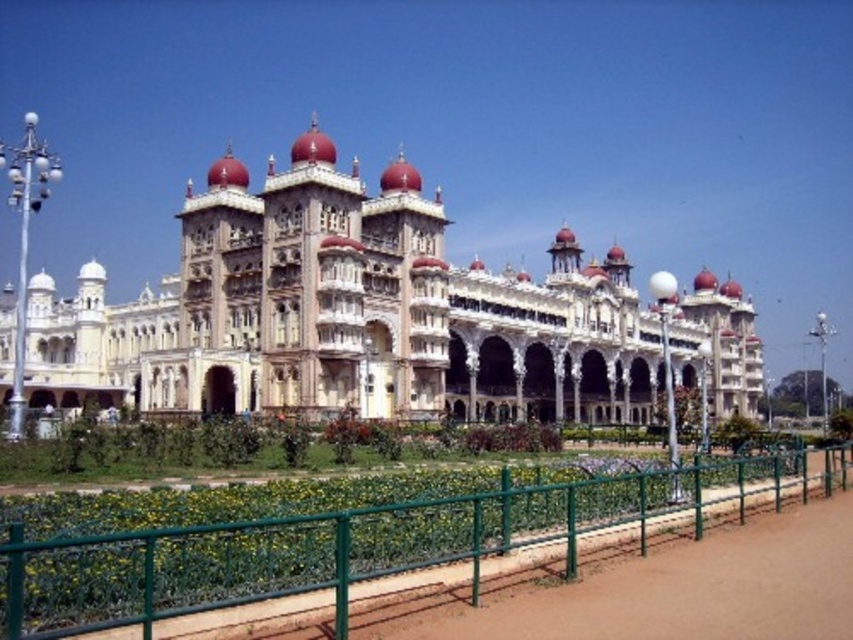
You are standing at the entrance of the white stone palace at center. If you walk straight ahead, will you exit the garden area immediately? Please explain your reasoning based on the garden layout described.

Based on the garden layout, the white stone palace at center is positioned at coordinates approximately halfway along the horizontal axis and slightly below the vertical midpoint. Since the garden extends around the palace and the fence is along the edge, walking straight ahead from the entrance would likely lead you deeper into the garden rather than exiting immediately. The palace is centrally located, so the garden likely surrounds it on all sides, requiring a turn towards the fence to exit.